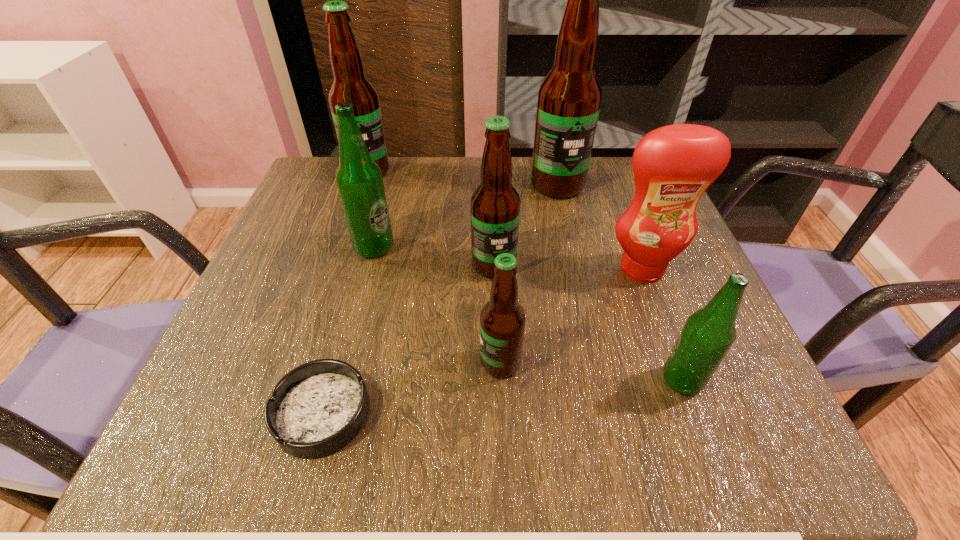
At what (x,y) coordinates should I click in order to perform the action: click on the smaller green beer bottle. Please return your answer as a coordinate pair (x, y). Looking at the image, I should click on [x=708, y=334].

Where is `the shortest object`? The width and height of the screenshot is (960, 540). the shortest object is located at coordinates (317, 408).

Identify the location of ashtray. (317, 408).

At what (x,y) coordinates should I click in order to perform the action: click on free space located 0.180m on the label of the second beer bottle from right to left. Please return your answer as a coordinate pair (x, y). Image resolution: width=960 pixels, height=540 pixels. Looking at the image, I should click on (572, 253).

Locate an element on the screen. free location located 0.090m on the label of the second tallest object is located at coordinates (357, 205).

In order to click on vacant space located 0.220m on the label of the bigger green beer bottle in this screenshot , I will do `click(502, 247)`.

Identify the location of vacant area situated on the label of the third biggest brown beer bottle. This screenshot has height=540, width=960. (495, 321).

At what (x,y) coordinates should I click in order to perform the action: click on free space located on the label side of the condiment. Please return your answer as a coordinate pair (x, y). Looking at the image, I should click on (662, 323).

Identify the location of vacant point located 0.350m on the label of the smallest brown beer bottle. (262, 362).

At what (x,y) coordinates should I click in order to perform the action: click on vacant space located on the label of the smallest brown beer bottle. Please return your answer as a coordinate pair (x, y). The height and width of the screenshot is (540, 960). Looking at the image, I should click on (430, 362).